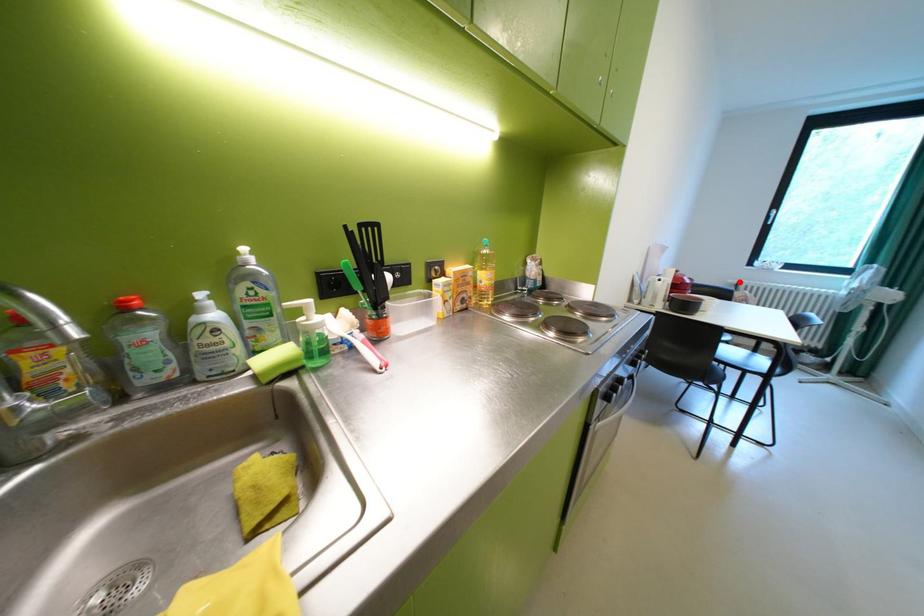
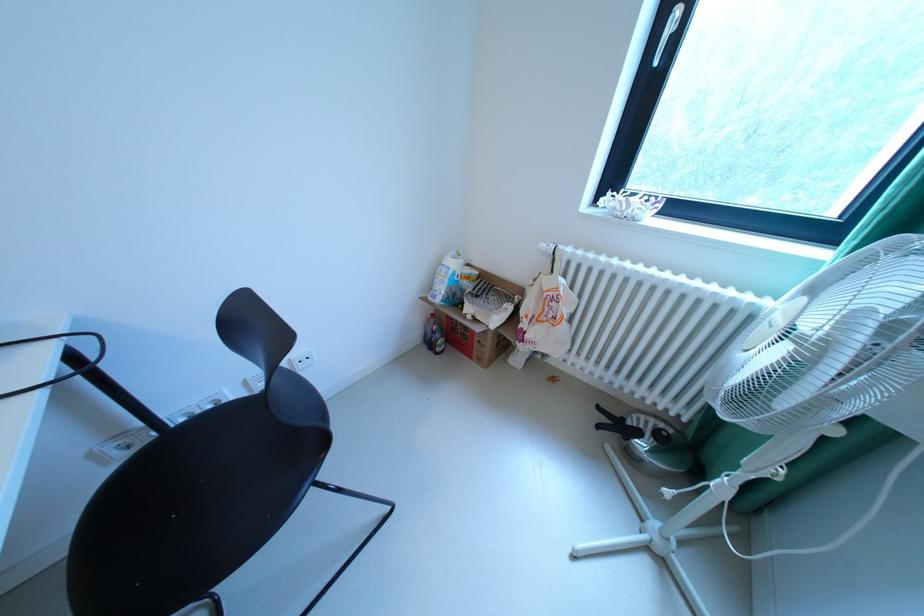
The point at the highlighted location is marked in the first image. Where is the corresponding point in the second image?

(553, 246)